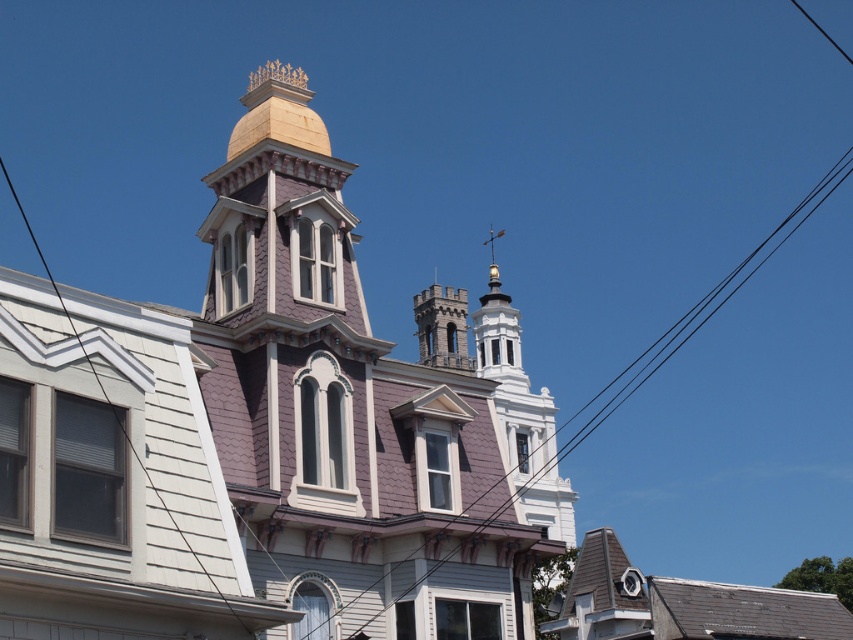
How distant is purple shingles at center from gray stone tower at center?

45.61 meters

Does purple shingles at center lie behind gray stone tower at center?

That is False.

At what (x,y) coordinates should I click in order to perform the action: click on purple shingles at center. Please return your answer as a coordinate pair (x, y). This screenshot has height=640, width=853. Looking at the image, I should click on (254, 438).

This screenshot has width=853, height=640. What are the coordinates of `purple shingles at center` in the screenshot? It's located at (254, 438).